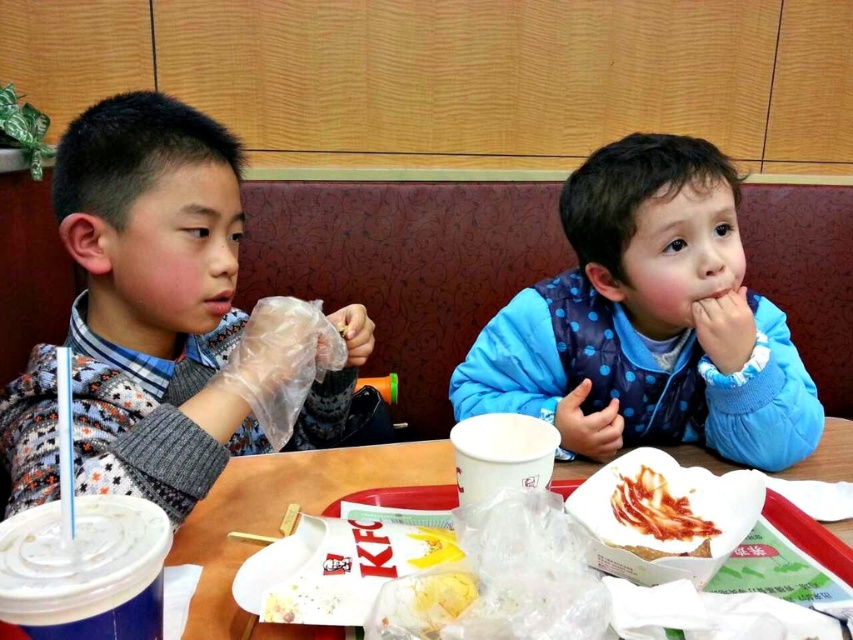
Between blue dotted vest at center and white paper cup at center, which one has more height?

Standing taller between the two is blue dotted vest at center.

Who is higher up, blue dotted vest at center or white paper cup at center?

blue dotted vest at center is above.

Which is in front, point (733, 184) or point (238, 524)?

Point (238, 524) is more forward.

This screenshot has width=853, height=640. Find the location of `blue dotted vest at center`. blue dotted vest at center is located at coordinates (648, 321).

Can you confirm if blue dotted vest at center is thinner than shiny red bacon at center?

No.

Is blue dotted vest at center positioned before shiny red bacon at center?

No, it is not.

Is point (556, 369) positioned before point (697, 531)?

No.

This screenshot has height=640, width=853. I want to click on blue dotted vest at center, so click(648, 321).

Does white paper cup at center appear on the right side of shiny red bacon at center?

No, white paper cup at center is not to the right of shiny red bacon at center.

Does white paper cup at center come in front of shiny red bacon at center?

Yes, it is.

Between point (352, 481) and point (618, 500), which one is positioned in front?

Point (618, 500) is in front.

Where is `white paper cup at center`? Image resolution: width=853 pixels, height=640 pixels. white paper cup at center is located at coordinates (282, 513).